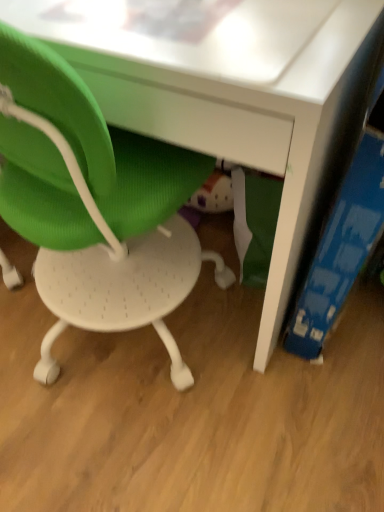
Identify the location of vacant space in green mesh chair at lower left (from a real-world perspective). (99, 356).